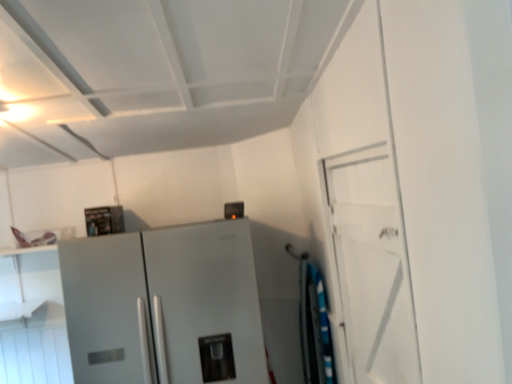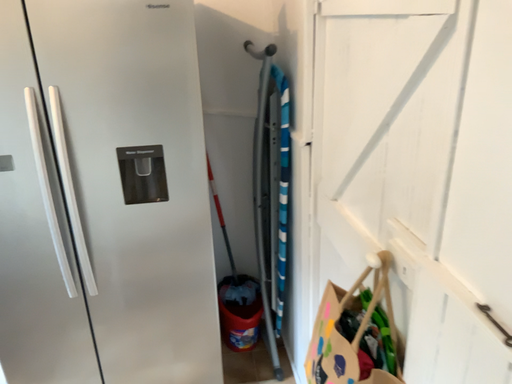
Question: Which way did the camera rotate in the video?

Choices:
 (A) rotated upward
 (B) rotated downward

Answer: (B)